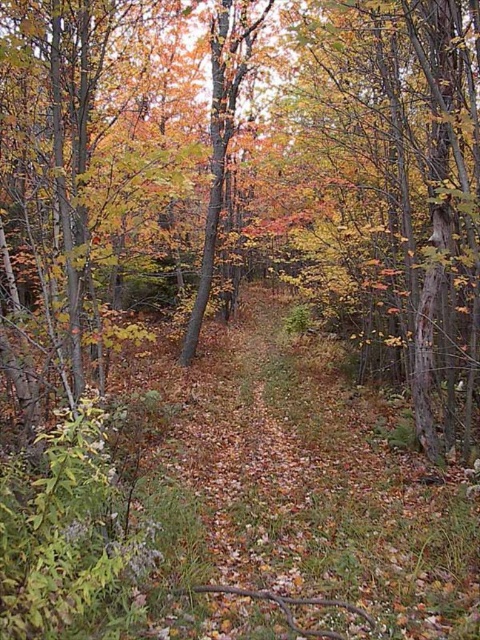
Find the location of a particular element. yellowish-brown bark tree at center is located at coordinates pyautogui.click(x=403, y=177).

Is yellowish-brown bark tree at center behind orange-brown bark tree at center?

No, yellowish-brown bark tree at center is closer to the viewer.

Who is more forward, (458, 266) or (243, 10)?

Point (458, 266) is in front.

Find the location of a particular element. The image size is (480, 640). yellowish-brown bark tree at center is located at coordinates (403, 177).